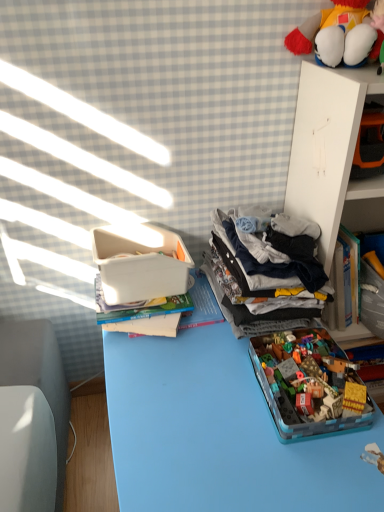
Where is `free space in front of dark gray cotton clothes at center right`? This screenshot has height=512, width=384. free space in front of dark gray cotton clothes at center right is located at coordinates (215, 393).